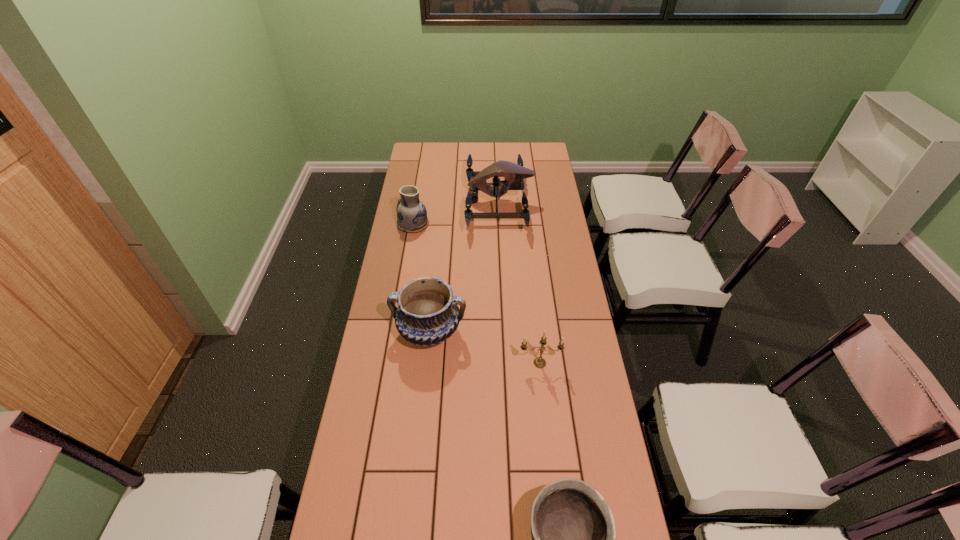
You are a GUI agent. You are given a task and a screenshot of the screen. Output one action in this format:
    pyautogui.click(x=<x>, y=<y>)
    Task: Click on the drone present at the right edge
    This screenshot has width=960, height=540.
    Given the screenshot: What is the action you would take?
    pyautogui.click(x=514, y=174)

Where is `candle located at the right edge`? The height and width of the screenshot is (540, 960). candle located at the right edge is located at coordinates (539, 362).

You are a GUI agent. You are given a task and a screenshot of the screen. Output one action in this format:
    pyautogui.click(x=<x>, y=<y>)
    Task: Click on the free space at the far edge
    This screenshot has height=540, width=960.
    Given the screenshot: What is the action you would take?
    (459, 159)

In the image, there is a desktop. Identify the location of free region at the left edge. The width and height of the screenshot is (960, 540). (359, 420).

Where is `free space at the right edge of the desktop`? The image size is (960, 540). free space at the right edge of the desktop is located at coordinates (553, 332).

Find the location of `vacant position at the far left corner of the desktop`. vacant position at the far left corner of the desktop is located at coordinates (420, 157).

The width and height of the screenshot is (960, 540). Find the location of `empty space between the second nearest pottery and the candle`. empty space between the second nearest pottery and the candle is located at coordinates (485, 347).

Find the location of a particular element. The height and width of the screenshot is (540, 960). free space between the candle and the second nearest pottery is located at coordinates (485, 347).

Locate an element on the screen. This screenshot has width=960, height=540. unoccupied position between the farthest pottery and the drone is located at coordinates (456, 213).

The image size is (960, 540). I want to click on vacant point located between the candle and the drone, so click(x=519, y=282).